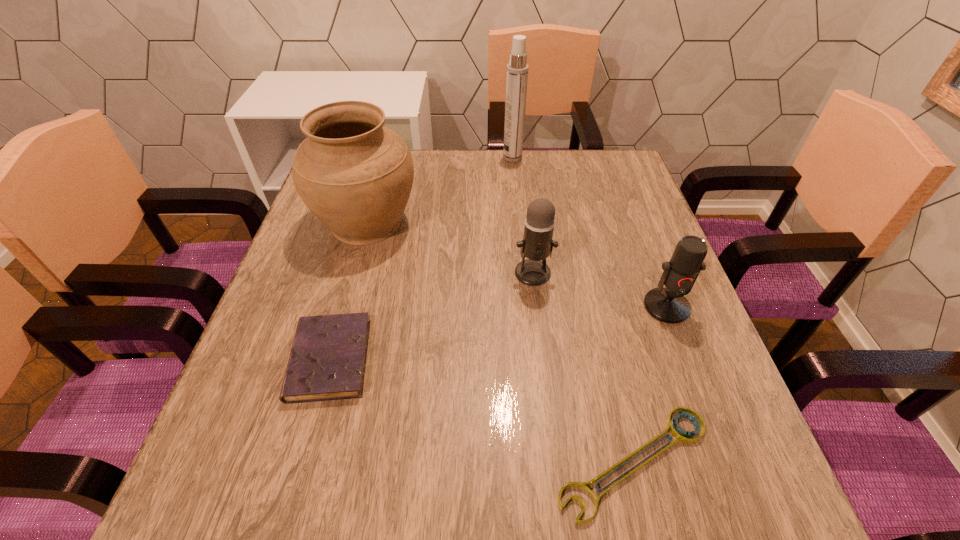
Image resolution: width=960 pixels, height=540 pixels. What are the coordinates of `aerosol can` in the screenshot? It's located at 517,70.

Find the location of a particular element. the farthest object is located at coordinates (517, 70).

Locate an element on the screen. This screenshot has height=540, width=960. the fifth shortest object is located at coordinates (355, 175).

Where is `the fifth nearest object`? This screenshot has height=540, width=960. the fifth nearest object is located at coordinates pyautogui.click(x=355, y=175).

I want to click on the left microphone, so 537,244.

Where is `the third farthest object`? the third farthest object is located at coordinates (537, 244).

This screenshot has width=960, height=540. Identify the location of the fourth tallest object. (669, 305).

The height and width of the screenshot is (540, 960). What are the coordinates of `the right microphone` in the screenshot? It's located at (669, 305).

Find the location of a particular element. This screenshot has width=960, height=540. diary is located at coordinates (327, 361).

Where is `wrench`? Image resolution: width=960 pixels, height=540 pixels. wrench is located at coordinates (682, 436).